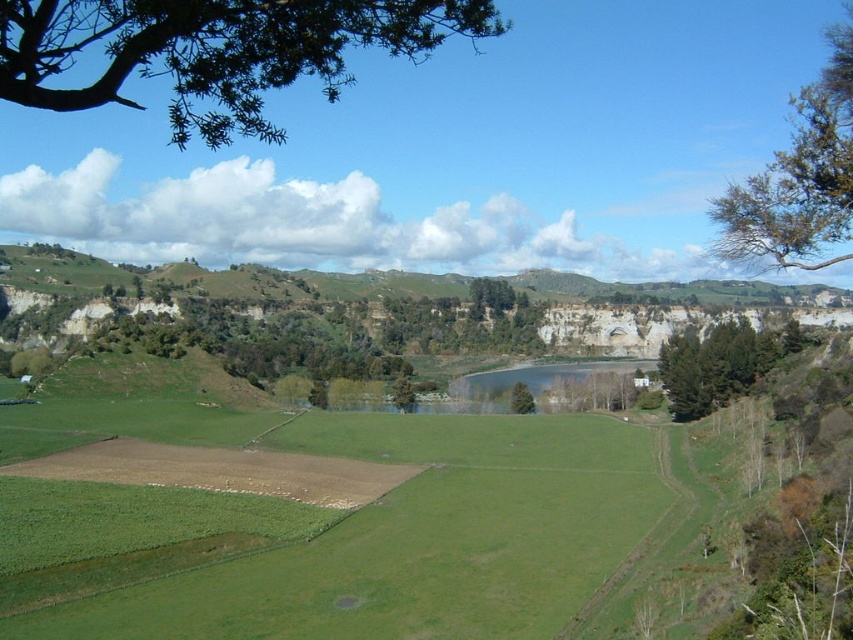
Does green grassy lake at center have a lesser height compared to green leafy tree at center?

No.

What do you see at coordinates (532, 381) in the screenshot? The width and height of the screenshot is (853, 640). I see `green grassy lake at center` at bounding box center [532, 381].

Locate an element on the screen. The image size is (853, 640). green grassy lake at center is located at coordinates (532, 381).

Between green leafy tree at right and green grassy lake at center, which one is positioned higher?

green leafy tree at right

Can you confirm if green leafy tree at right is smaller than green grassy lake at center?

No.

The image size is (853, 640). In order to click on green leafy tree at right in this screenshot , I will do `click(720, 364)`.

Where is `green leafy tree at right`? The width and height of the screenshot is (853, 640). green leafy tree at right is located at coordinates (720, 364).

Between green leafy tree at upper left and green leafy tree at right, which one has more height?

Standing taller between the two is green leafy tree at upper left.

Between green leafy tree at upper left and green leafy tree at right, which one appears on the right side from the viewer's perspective?

Positioned to the right is green leafy tree at right.

At what (x,y) coordinates should I click in order to perform the action: click on green leafy tree at upper left. Please return your answer as a coordinate pair (x, y). This screenshot has height=640, width=853. Looking at the image, I should click on (215, 51).

The image size is (853, 640). I want to click on green leafy tree at upper left, so click(x=215, y=51).